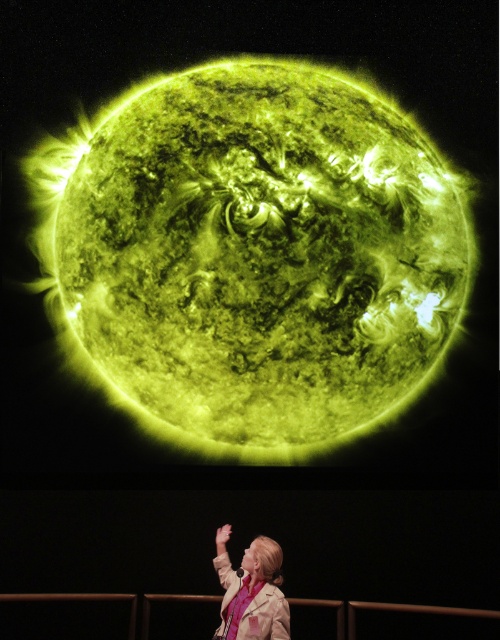
You are an astronaut floating in space and see the beige fabric jacket at lower center. If you want to reach the jacket, which direction should you move relative to the Sun projection?

The beige fabric jacket at lower center is located below the Sun projection, so you should move downward towards it.